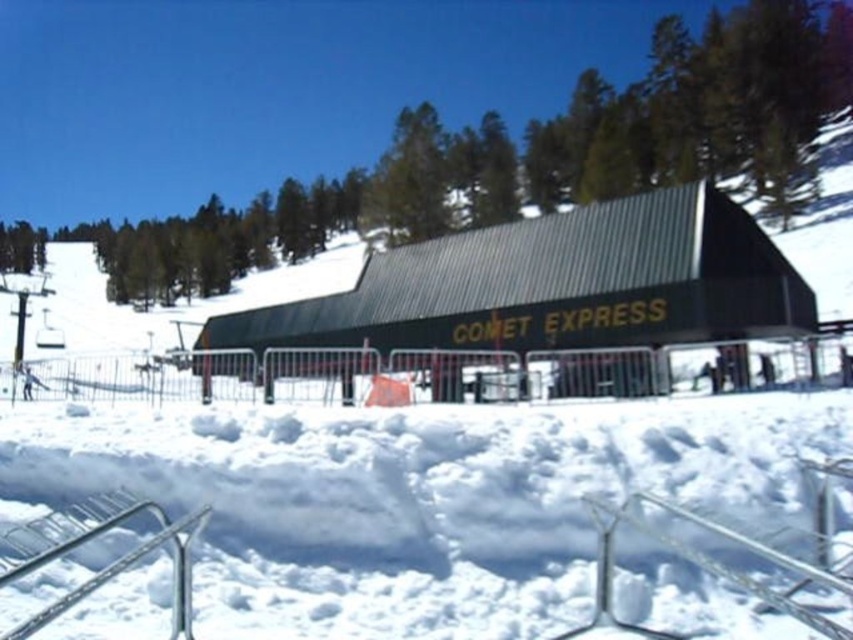
Question: Can you confirm if metallic silver rail at lower left is positioned to the right of metallic silver rail at lower center?

Choices:
 (A) no
 (B) yes

Answer: (A)

Question: Which point is farther to the camera?

Choices:
 (A) (640, 589)
 (B) (683, 189)
 (C) (596, 596)

Answer: (B)

Question: Which point is farther from the camera taking this photo?

Choices:
 (A) (675, 588)
 (B) (691, 548)
 (C) (438, 259)

Answer: (C)

Question: Which point is closer to the camera taking this photo?

Choices:
 (A) (175, 616)
 (B) (589, 234)
 (C) (848, 593)

Answer: (C)

Question: Is metallic green building at center wider than metallic silver rail at lower left?

Choices:
 (A) no
 (B) yes

Answer: (B)

Question: Considering the relative positions of white fluffy snow at center and metallic silver rail at lower center in the image provided, where is white fluffy snow at center located with respect to metallic silver rail at lower center?

Choices:
 (A) right
 (B) left

Answer: (B)